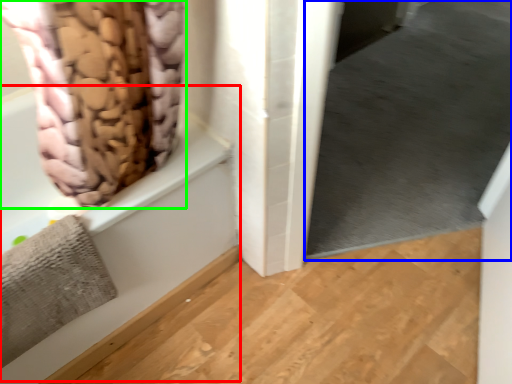
Question: Estimate the real-world distances between objects in this image. Which object is closer to bath (highlighted by a red box), window screen (highlighted by a blue box) or curtain (highlighted by a green box)?

Choices:
 (A) window screen
 (B) curtain

Answer: (B)